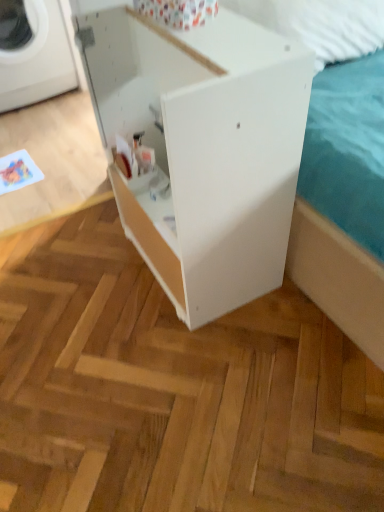
Question: Is white plastic washing machine at left beside white matte cabinet at center?

Choices:
 (A) no
 (B) yes

Answer: (A)

Question: From the image's perspective, is white plastic washing machine at left below white matte cabinet at center?

Choices:
 (A) no
 (B) yes

Answer: (A)

Question: From a real-world perspective, is white plastic washing machine at left below white matte cabinet at center?

Choices:
 (A) yes
 (B) no

Answer: (A)

Question: Is white plastic washing machine at left aimed at white matte cabinet at center?

Choices:
 (A) no
 (B) yes

Answer: (B)

Question: Can you confirm if white plastic washing machine at left is wider than white matte cabinet at center?

Choices:
 (A) no
 (B) yes

Answer: (B)

Question: From the image's perspective, would you say white plastic washing machine at left is positioned over white matte cabinet at center?

Choices:
 (A) yes
 (B) no

Answer: (A)

Question: Does white matte cabinet at center appear on the right side of white plastic washing machine at left?

Choices:
 (A) no
 (B) yes

Answer: (B)

Question: Is white matte cabinet at center outside of white plastic washing machine at left?

Choices:
 (A) no
 (B) yes

Answer: (B)

Question: Does white matte cabinet at center appear on the left side of white plastic washing machine at left?

Choices:
 (A) no
 (B) yes

Answer: (A)

Question: Can you confirm if white matte cabinet at center is smaller than white plastic washing machine at left?

Choices:
 (A) no
 (B) yes

Answer: (A)

Question: Is the position of white matte cabinet at center more distant than that of white plastic washing machine at left?

Choices:
 (A) yes
 (B) no

Answer: (B)

Question: Is white matte cabinet at center bigger than white plastic washing machine at left?

Choices:
 (A) yes
 (B) no

Answer: (A)

Question: In terms of height, does white plastic washing machine at left look taller or shorter compared to white matte cabinet at center?

Choices:
 (A) short
 (B) tall

Answer: (A)